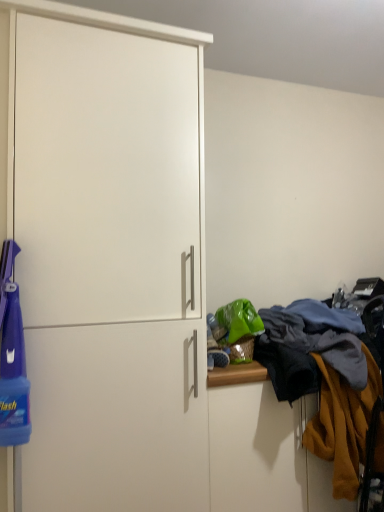
Question: Is textured woolen sweater at right to the right of mustard yellow fabric at right from the viewer's perspective?

Choices:
 (A) yes
 (B) no

Answer: (B)

Question: From the image's perspective, is textured woolen sweater at right over mustard yellow fabric at right?

Choices:
 (A) no
 (B) yes

Answer: (B)

Question: Could you tell me if textured woolen sweater at right is facing mustard yellow fabric at right?

Choices:
 (A) no
 (B) yes

Answer: (B)

Question: Does textured woolen sweater at right have a larger size compared to mustard yellow fabric at right?

Choices:
 (A) yes
 (B) no

Answer: (A)

Question: Would you say textured woolen sweater at right is a long distance from mustard yellow fabric at right?

Choices:
 (A) yes
 (B) no

Answer: (B)

Question: Considering the relative positions of white matte cabinet at left and textured woolen sweater at right in the image provided, is white matte cabinet at left to the left or to the right of textured woolen sweater at right?

Choices:
 (A) right
 (B) left

Answer: (B)

Question: Is white matte cabinet at left inside or outside of textured woolen sweater at right?

Choices:
 (A) outside
 (B) inside

Answer: (A)

Question: Considering the positions of white matte cabinet at left and textured woolen sweater at right in the image, is white matte cabinet at left wider or thinner than textured woolen sweater at right?

Choices:
 (A) thin
 (B) wide

Answer: (A)

Question: Does point (193, 287) appear closer or farther from the camera than point (357, 437)?

Choices:
 (A) closer
 (B) farther

Answer: (A)

Question: In the image, is mustard yellow fabric at right positioned in front of or behind textured woolen sweater at right?

Choices:
 (A) behind
 (B) front

Answer: (B)

Question: From their relative heights in the image, would you say mustard yellow fabric at right is taller or shorter than textured woolen sweater at right?

Choices:
 (A) short
 (B) tall

Answer: (B)

Question: Which is correct: mustard yellow fabric at right is inside textured woolen sweater at right, or outside of it?

Choices:
 (A) outside
 (B) inside

Answer: (B)

Question: Looking at their shapes, would you say mustard yellow fabric at right is wider or thinner than textured woolen sweater at right?

Choices:
 (A) wide
 (B) thin

Answer: (B)

Question: Is textured woolen sweater at right in front of or behind mustard yellow fabric at right in the image?

Choices:
 (A) front
 (B) behind

Answer: (B)

Question: Is textured woolen sweater at right taller or shorter than mustard yellow fabric at right?

Choices:
 (A) short
 (B) tall

Answer: (A)